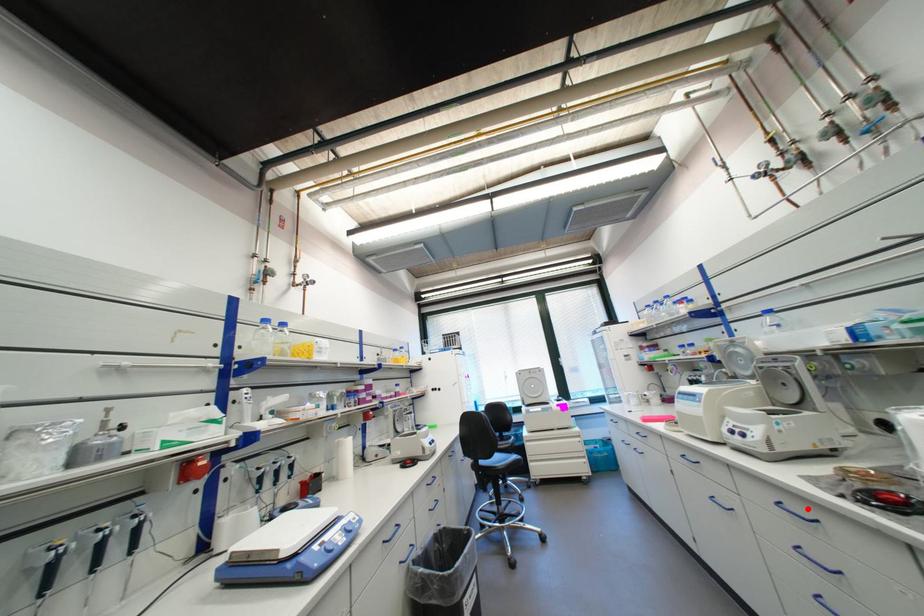
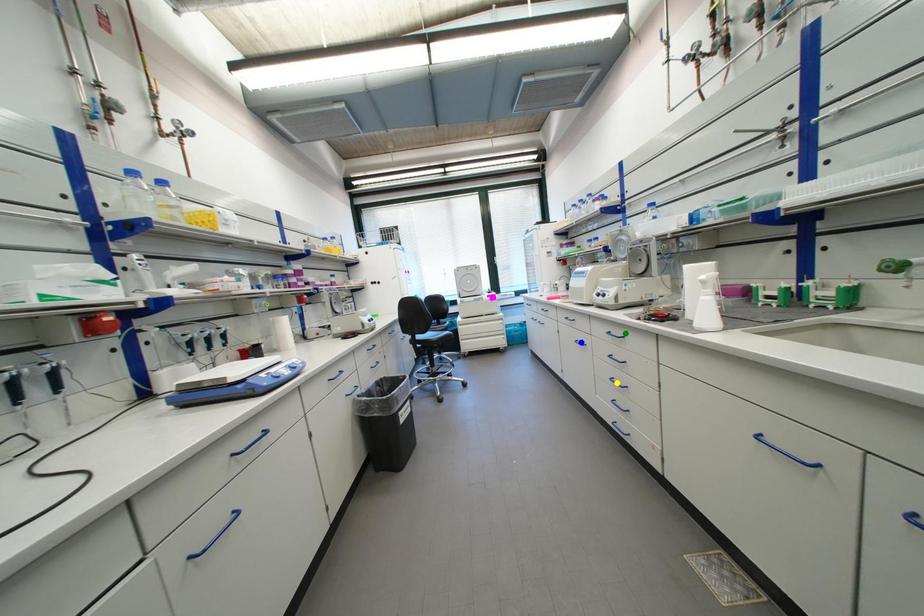
Question: I am providing you with two images of the same scene from different viewpoints. A red point is marked on the first image. You are given multiple points on the second image. Which mark in image 2 goes with the point in image 1?

Choices:
 (A) blue point
 (B) yellow point
 (C) green point

Answer: (C)